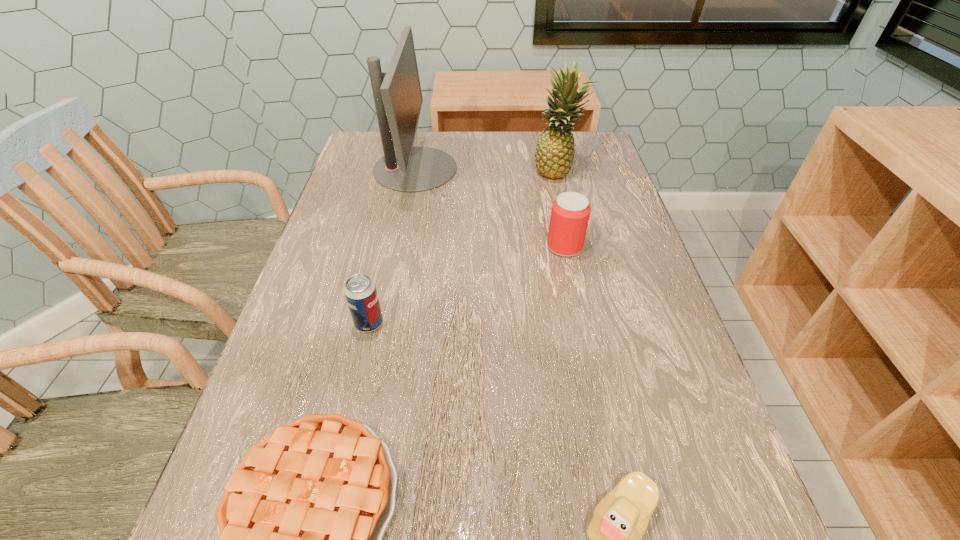
This screenshot has height=540, width=960. In order to click on vacant space that satisfies the following two spatial constraints: 1. on the screen of the computer monitor; 2. on the left side of the right beer can in this screenshot , I will do `click(400, 247)`.